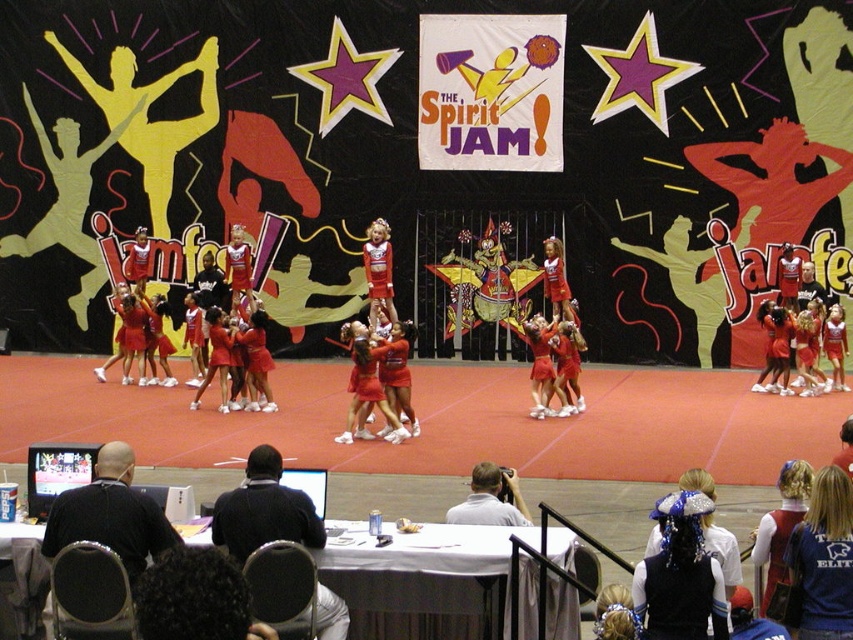
Question: Among these objects, which one is farthest from the camera?

Choices:
 (A) dark blue sweater at center
 (B) dark curly hair at lower left
 (C) matte red cheerleader at center
 (D) gray fabric camera at center

Answer: (C)

Question: Based on their relative distances, which object is nearer to the blue jersey at center?

Choices:
 (A) matte red cheerleader at center
 (B) black shirt at center

Answer: (B)

Question: Is gray fabric camera at center positioned behind matte red cheerleader at center?

Choices:
 (A) no
 (B) yes

Answer: (A)

Question: Which object appears closest to the camera in this image?

Choices:
 (A) matte red cheerleader at center
 (B) blue jersey at center
 (C) dark blue sweater at center
 (D) dark curly hair at lower left

Answer: (D)

Question: Does dark curly hair at lower left lie behind blue jersey at center?

Choices:
 (A) yes
 (B) no

Answer: (B)

Question: From the image, what is the correct spatial relationship of dark curly hair at lower left in relation to matte red cheerleader at center?

Choices:
 (A) left
 (B) right

Answer: (A)